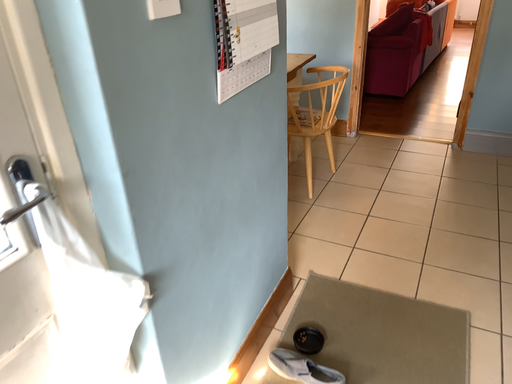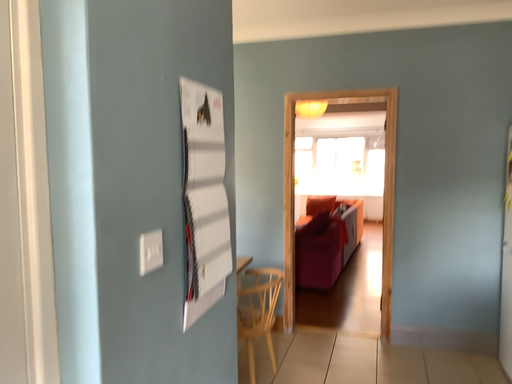
Question: Which way did the camera rotate in the video?

Choices:
 (A) rotated right
 (B) rotated left

Answer: (A)